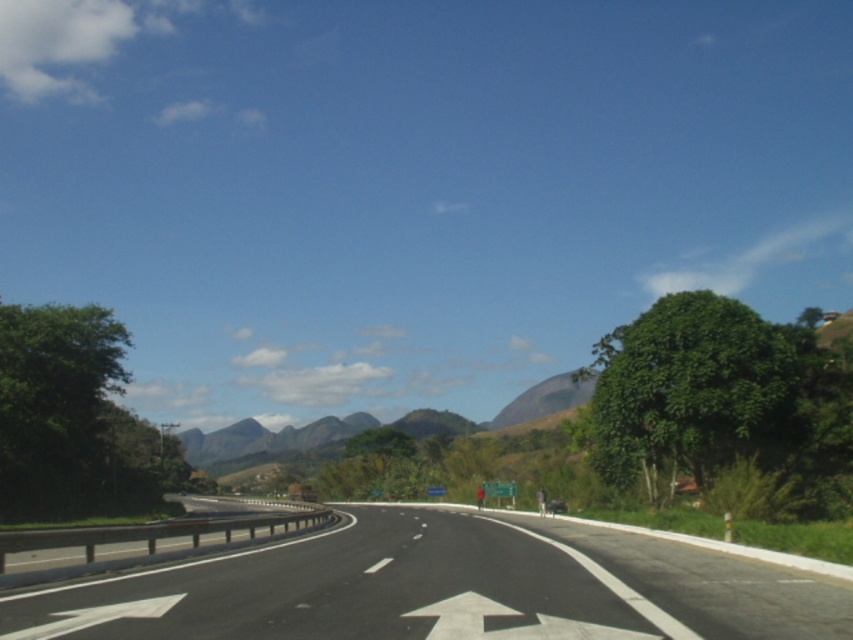
Does black asphalt road at center have a larger size compared to white glossy arrow at center?

Indeed, black asphalt road at center has a larger size compared to white glossy arrow at center.

Locate an element on the screen. This screenshot has width=853, height=640. black asphalt road at center is located at coordinates (444, 588).

This screenshot has width=853, height=640. What are the coordinates of `black asphalt road at center` in the screenshot? It's located at click(x=444, y=588).